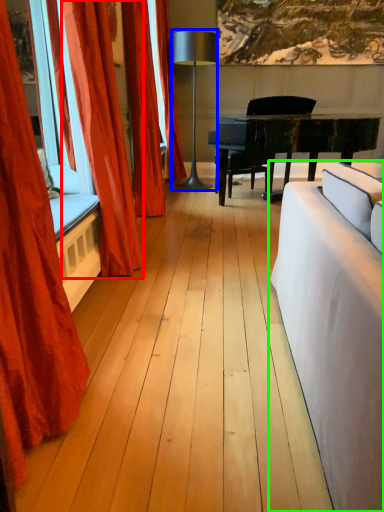
Question: Based on their relative distances, which object is nearer to curtain (highlighted by a red box)? Choose from lamp (highlighted by a blue box) and studio couch (highlighted by a green box).

Choices:
 (A) lamp
 (B) studio couch

Answer: (B)